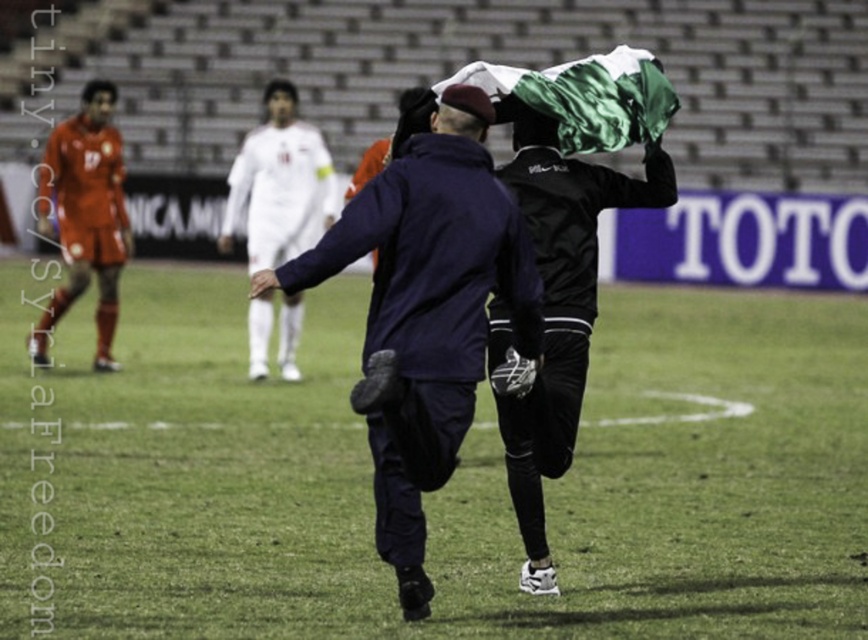
Question: Considering the relative positions of dark blue jacket at center and black matte jacket at center in the image provided, where is dark blue jacket at center located with respect to black matte jacket at center?

Choices:
 (A) left
 (B) right

Answer: (A)

Question: Among these objects, which one is nearest to the camera?

Choices:
 (A) orange jersey at left
 (B) dark blue jacket at center
 (C) white smooth soccer ball at center
 (D) green grass at center

Answer: (B)

Question: Which object appears farthest from the camera in this image?

Choices:
 (A) white smooth soccer ball at center
 (B) orange jersey at left
 (C) green grass at center

Answer: (A)

Question: Is dark blue jacket at center to the right of white smooth soccer ball at center from the viewer's perspective?

Choices:
 (A) no
 (B) yes

Answer: (B)

Question: Which is nearer to the dark blue jacket at center?

Choices:
 (A) white smooth soccer ball at center
 (B) black matte jacket at center
 (C) orange jersey at left

Answer: (B)

Question: Can you confirm if black matte jacket at center is bigger than white smooth soccer ball at center?

Choices:
 (A) yes
 (B) no

Answer: (A)